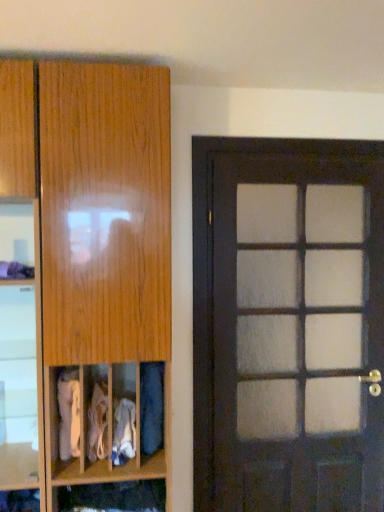
Question: Would you say wooden cabinet at left is inside or outside white fabric at lower left, which is the 4th clothing from right to left?

Choices:
 (A) inside
 (B) outside

Answer: (B)

Question: From a real-world perspective, is wooden cabinet at left physically located above or below white fabric at lower left, placed as the 1th clothing when sorted from left to right?

Choices:
 (A) below
 (B) above

Answer: (B)

Question: Which object is positioned closest to the wooden cabinet at lower center?

Choices:
 (A) white fabric at center, which is the second clothing in right-to-left order
 (B) blue fabric at lower left, the first clothing viewed from the right
 (C) dark wood door at right
 (D) white cotton socks at center, positioned as the 3th clothing in right-to-left order
 (E) white fabric at lower left, placed as the 1th clothing when sorted from left to right

Answer: (A)

Question: Which object is positioned closest to the wooden cabinet at left?

Choices:
 (A) white cotton socks at center, which is counted as the second clothing, starting from the left
 (B) wooden cabinet at lower center
 (C) white fabric at lower left, placed as the 1th clothing when sorted from left to right
 (D) dark wood door at right
 (E) blue fabric at lower left, the first clothing viewed from the right

Answer: (E)